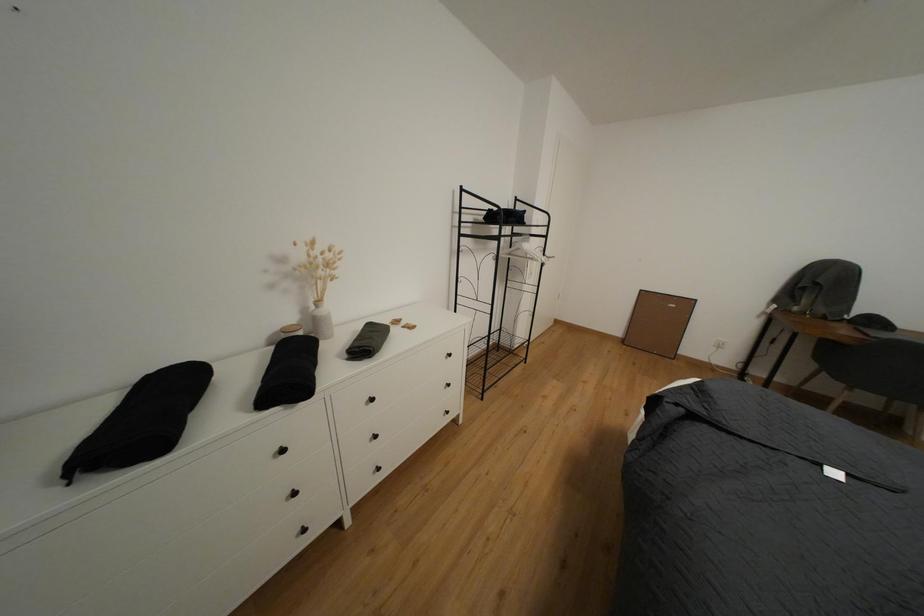
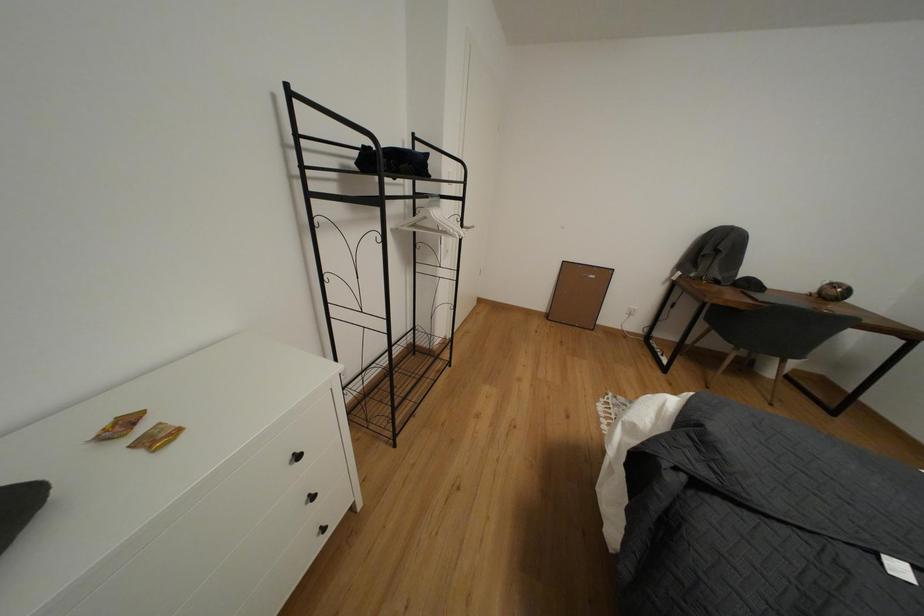
Question: The camera is either moving clockwise (left) or counter-clockwise (right) around the object. The first image is from the beginning of the video and the second image is from the end. Is the camera moving left or right when shooting the video?

Choices:
 (A) Left
 (B) Right

Answer: (A)